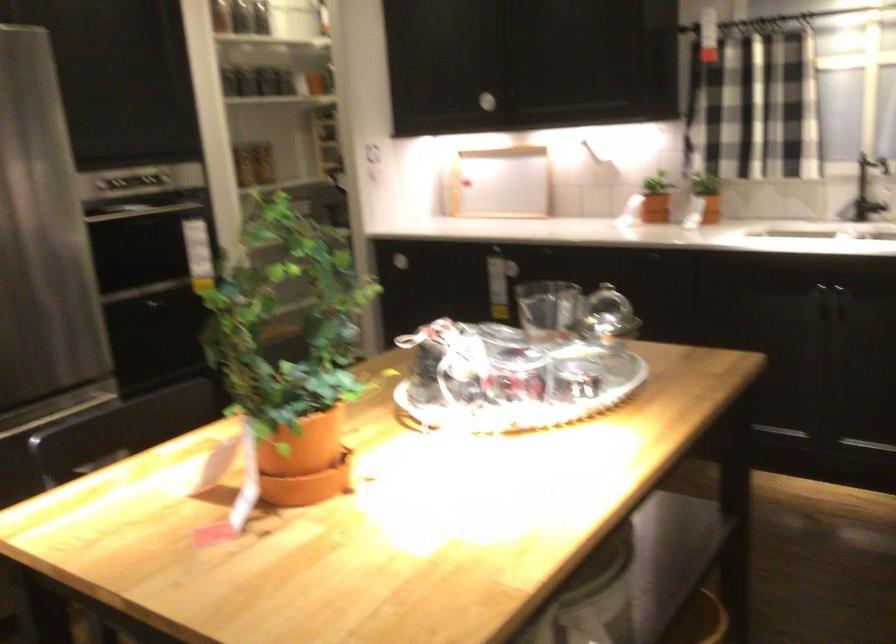
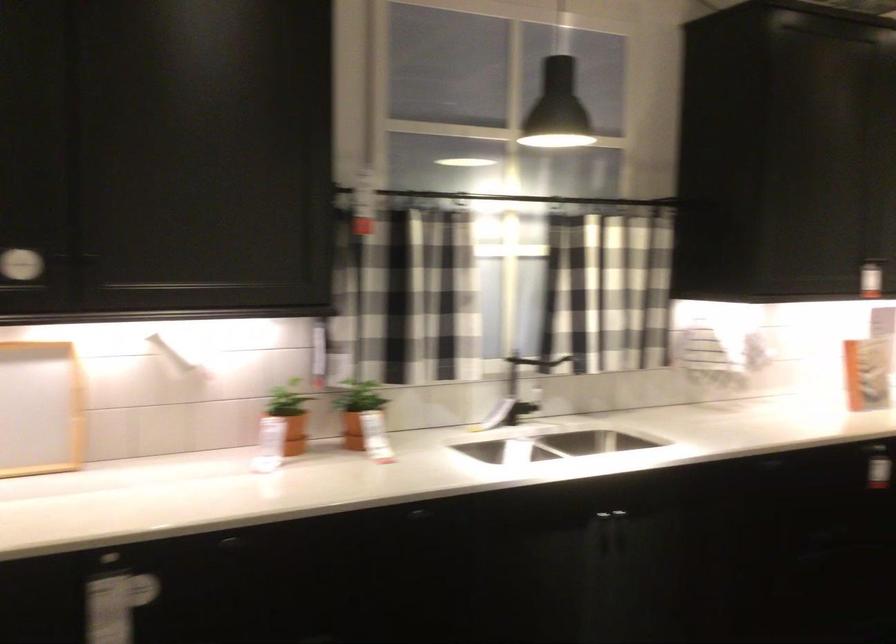
Where in the second image is the point corresponding to the point at 662,187 from the first image?

(289, 415)